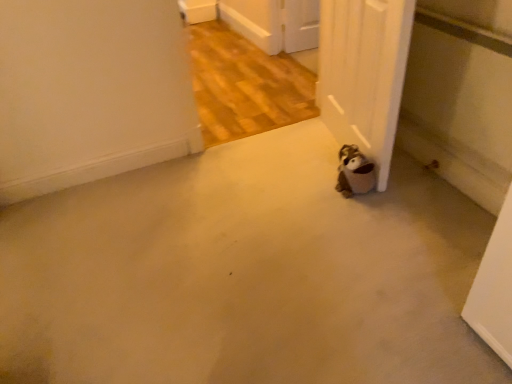
Question: From their relative heights in the image, would you say brown plush toy at lower right is taller or shorter than white matte door at lower right?

Choices:
 (A) short
 (B) tall

Answer: (A)

Question: Is brown plush toy at lower right inside the boundaries of white matte door at lower right, or outside?

Choices:
 (A) inside
 (B) outside

Answer: (A)

Question: Which object is positioned closest to the white matte door at lower right?

Choices:
 (A) brown plush toy at lower right
 (B) beige carpet at lower center

Answer: (A)

Question: Which is farther from the beige carpet at lower center?

Choices:
 (A) brown plush toy at lower right
 (B) white matte door at lower right

Answer: (B)